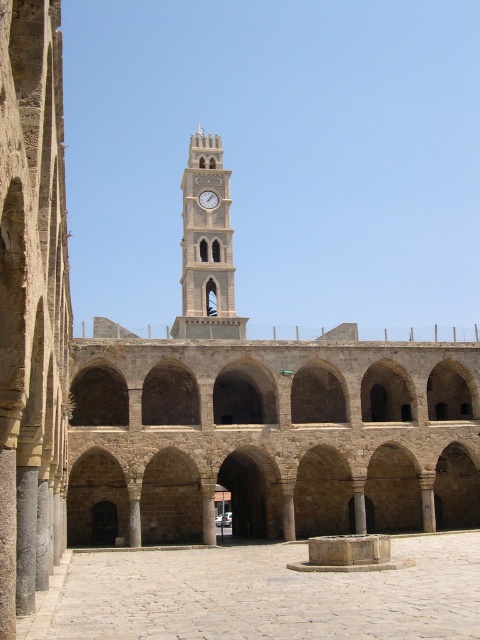
Does smooth stone fountain at center have a smaller size compared to metallic clock at center?

Incorrect, smooth stone fountain at center is not smaller in size than metallic clock at center.

Identify the location of smooth stone fountain at center. (259, 595).

Between white stone clock tower at center and metallic clock at center, which one is positioned lower?

Positioned lower is white stone clock tower at center.

Who is more forward, (x=226, y=211) or (x=199, y=200)?

Point (x=199, y=200) is in front.

Is point (182, 324) positioned behind point (201, 192)?

No, (182, 324) is in front of (201, 192).

The height and width of the screenshot is (640, 480). I want to click on white stone clock tower at center, so click(x=206, y=248).

Is smooth stone fountain at center to the right of white stone clock tower at center from the viewer's perspective?

Correct, you'll find smooth stone fountain at center to the right of white stone clock tower at center.

Is smooth stone fountain at center positioned behind white stone clock tower at center?

That is False.

Is point (291, 550) closer to viewer compared to point (202, 337)?

Yes.

Locate an element on the screen. This screenshot has height=640, width=480. smooth stone fountain at center is located at coordinates (259, 595).